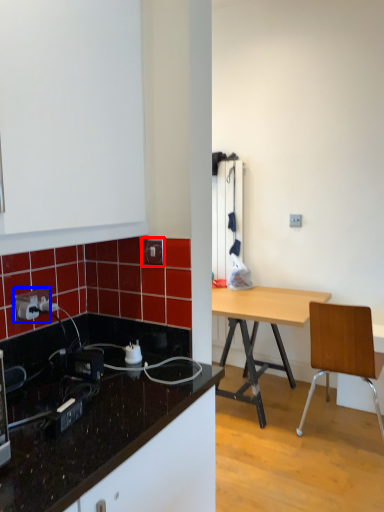
Question: Which of the following is the closest to the observer, electric outlet (highlighted by a red box) or power outlet (highlighted by a blue box)?

Choices:
 (A) electric outlet
 (B) power outlet

Answer: (B)